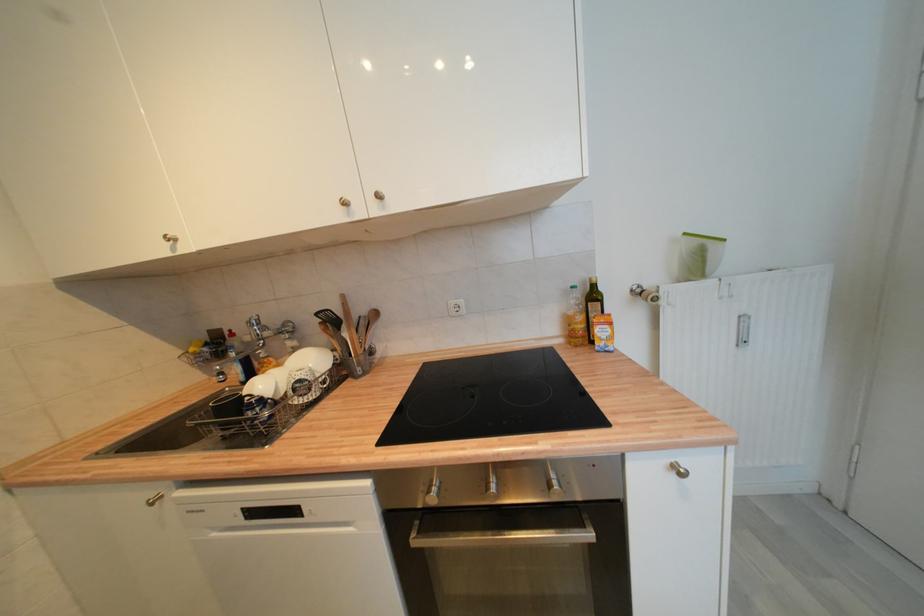
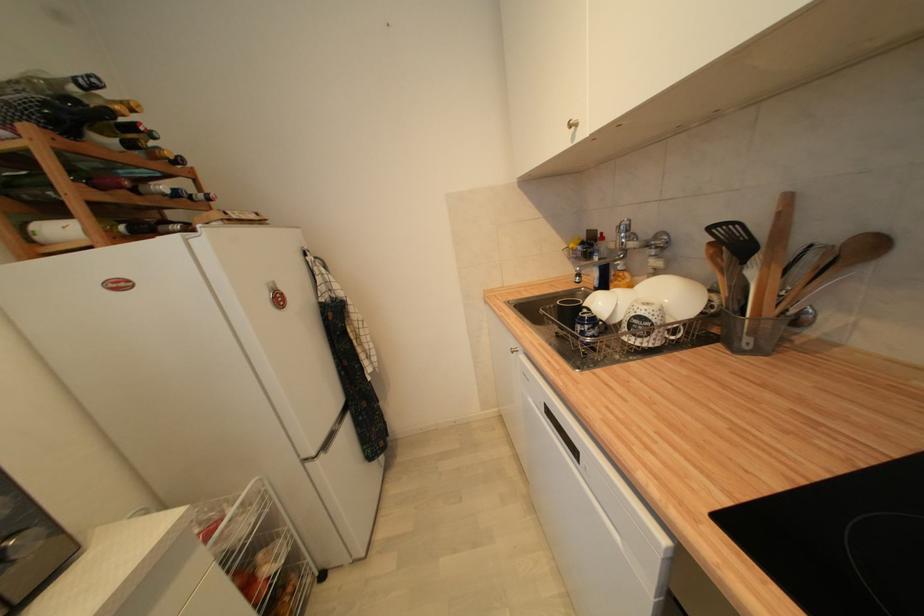
The point at [258,411] is marked in the first image. Where is the corresponding point in the second image?

(588, 326)